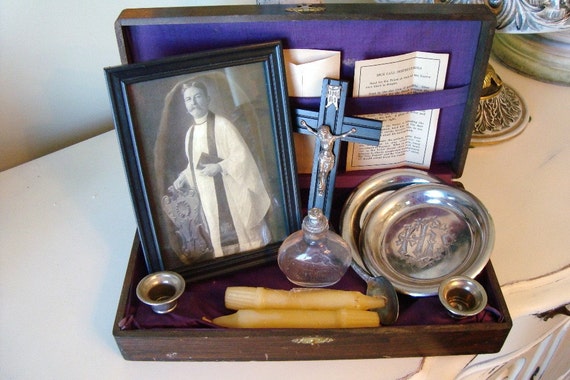
Where is `candle`? This screenshot has height=380, width=570. candle is located at coordinates (288, 320), (304, 299).